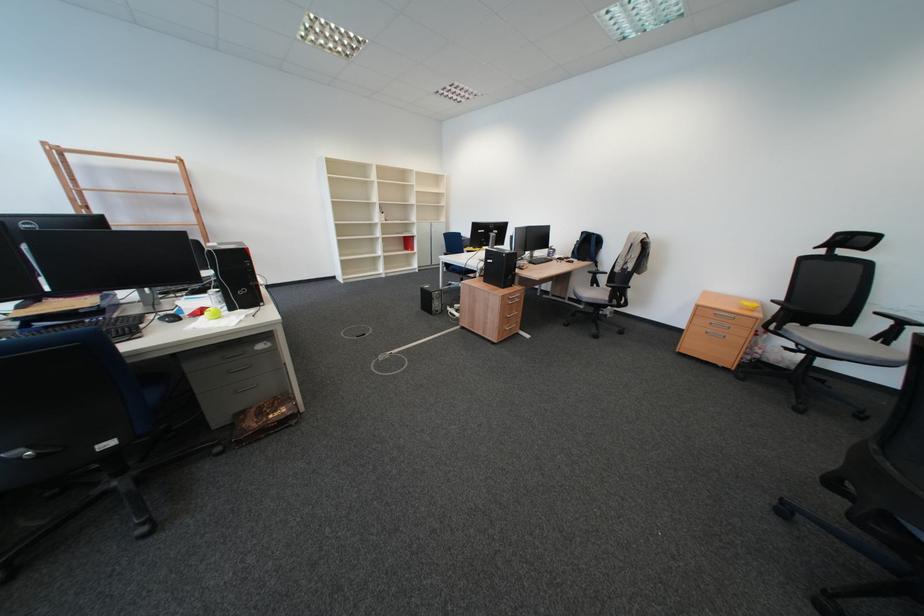
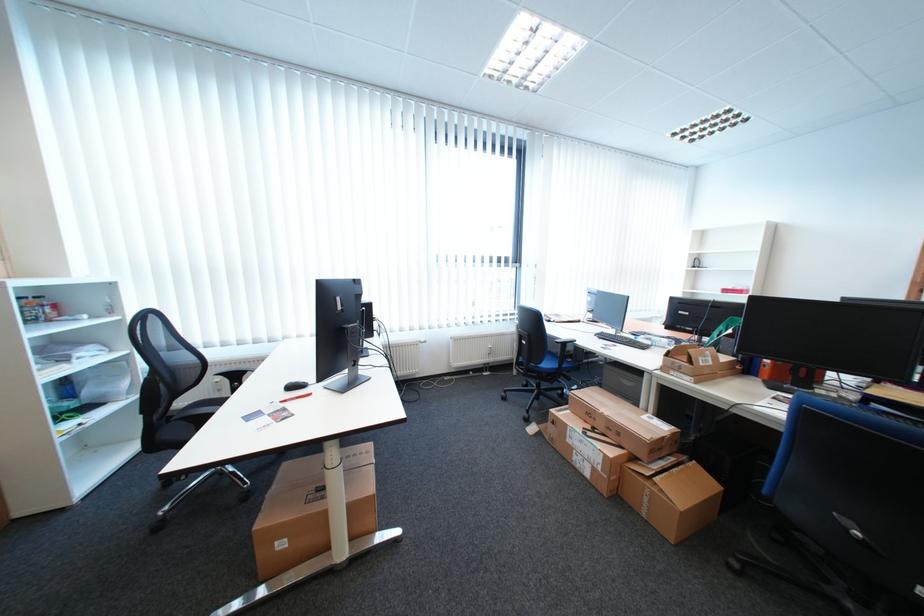
Question: How did the camera likely rotate?

Choices:
 (A) Left
 (B) Right
 (C) Up
 (D) Down

Answer: (A)